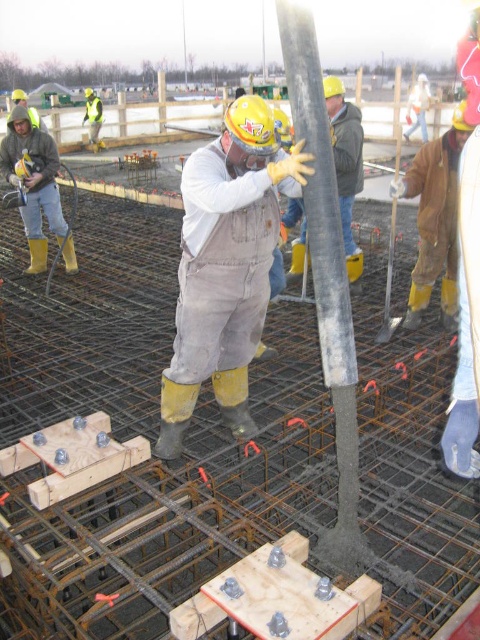
Does smooth concrete pole at center have a greater width compared to yellow rubber boots at left?

No.

Between smooth concrete pole at center and yellow rubber boots at left, which one has more height?

Standing taller between the two is smooth concrete pole at center.

Which is behind, point (339, 513) or point (20, 129)?

Point (20, 129)

Where is `smooth concrete pole at center`? Image resolution: width=480 pixels, height=640 pixels. smooth concrete pole at center is located at coordinates (326, 282).

Does gray denim overalls at center have a greater height compared to reflective yellow safety vest at upper left?

No.

Can you confirm if gray denim overalls at center is bigger than reflective yellow safety vest at upper left?

No, gray denim overalls at center is not bigger than reflective yellow safety vest at upper left.

Is point (196, 380) farther from viewer compared to point (93, 145)?

No.

The width and height of the screenshot is (480, 640). In order to click on gray denim overalls at center in this screenshot , I will do `click(226, 266)`.

Which is more to the left, matte gray pole at center or reflective yellow safety vest at upper left?

reflective yellow safety vest at upper left is more to the left.

Is matte gray pole at center thinner than reflective yellow safety vest at upper left?

Yes, matte gray pole at center is thinner than reflective yellow safety vest at upper left.

Does point (342, 134) lie behind point (101, 116)?

No, (342, 134) is closer to viewer.

Where is `matte gray pole at center`? This screenshot has height=640, width=480. matte gray pole at center is located at coordinates (346, 163).